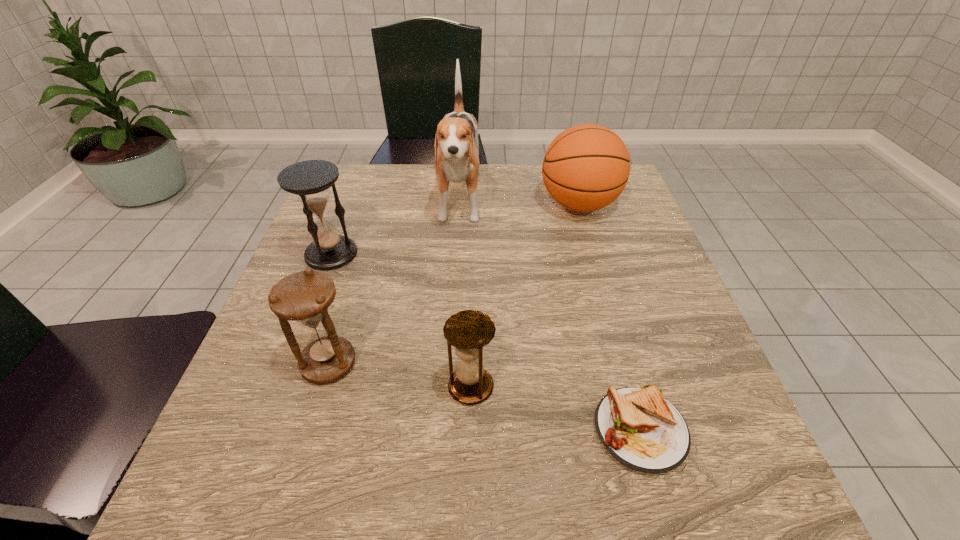
This screenshot has height=540, width=960. In order to click on blank area located on the back of the shortest object in this screenshot , I will do `click(591, 258)`.

At what (x,y) coordinates should I click in order to perform the action: click on puppy that is at the far edge. Please return your answer as a coordinate pair (x, y). Looking at the image, I should click on (456, 145).

You are a GUI agent. You are given a task and a screenshot of the screen. Output one action in this format:
    pyautogui.click(x=<x>, y=<y>)
    Task: Click on the basketball at the far edge
    Image resolution: width=960 pixels, height=540 pixels.
    Given the screenshot: What is the action you would take?
    pyautogui.click(x=586, y=167)

Identify the location of object situated at the near edge. This screenshot has width=960, height=540. (642, 430).

The height and width of the screenshot is (540, 960). Identify the location of basketball located at the right edge. (586, 167).

This screenshot has height=540, width=960. I want to click on sandwich present at the right edge, so click(x=642, y=430).

Where is `object at the far right corner`? The width and height of the screenshot is (960, 540). object at the far right corner is located at coordinates (586, 167).

You are a GUI agent. You are given a task and a screenshot of the screen. Output one action in this format:
    pyautogui.click(x=<x>, y=<y>)
    Task: Click on the object located at the near right corner
    The height and width of the screenshot is (540, 960).
    Given the screenshot: What is the action you would take?
    pyautogui.click(x=642, y=430)

This screenshot has width=960, height=540. I want to click on free point at the far edge, so click(x=404, y=173).

The height and width of the screenshot is (540, 960). I want to click on free spot at the near edge of the desktop, so click(x=321, y=472).